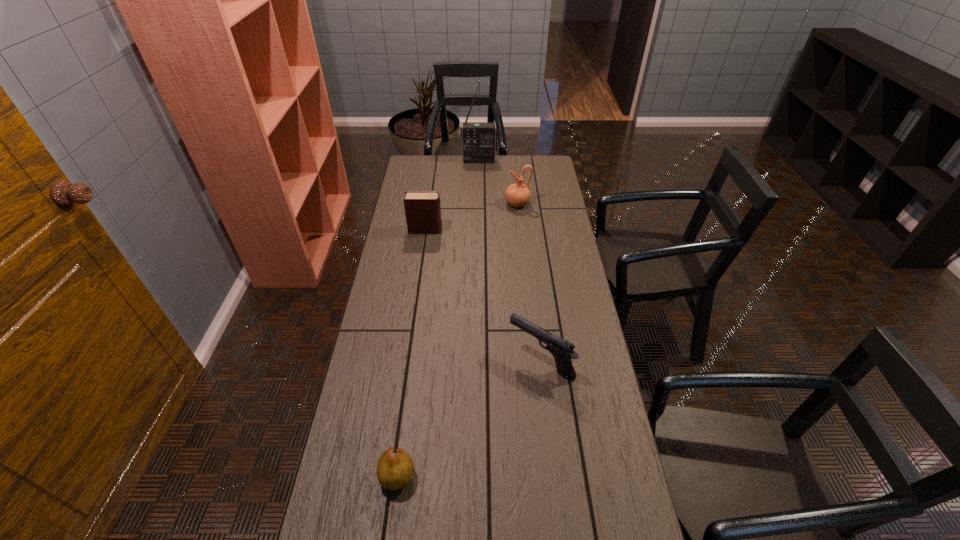
The image size is (960, 540). I want to click on radio receiver, so click(479, 140).

Identify the location of the tallest object. The height and width of the screenshot is (540, 960). (479, 140).

What are the coordinates of `pottery` in the screenshot? It's located at (x=517, y=195).

You are a GUI agent. You are given a task and a screenshot of the screen. Output one action in this format:
    pyautogui.click(x=<x>, y=<y>)
    Task: Click on the third nearest object
    The image size is (960, 540).
    Given the screenshot: What is the action you would take?
    pyautogui.click(x=422, y=208)

This screenshot has height=540, width=960. Find the location of `the second nearest object`. the second nearest object is located at coordinates (562, 350).

The image size is (960, 540). I want to click on the nearest object, so click(x=395, y=468).

Image resolution: width=960 pixels, height=540 pixels. In order to click on the shortest object in this screenshot , I will do `click(395, 468)`.

Locate an element on the screen. The image size is (960, 540). free space located on the display of the radio receiver is located at coordinates (479, 175).

Identify the location of vacant position located on the spout of the fourth nearest object. This screenshot has height=540, width=960. (429, 204).

The image size is (960, 540). Identify the location of vacant space situated 0.130m on the spout of the fourth nearest object. (477, 204).